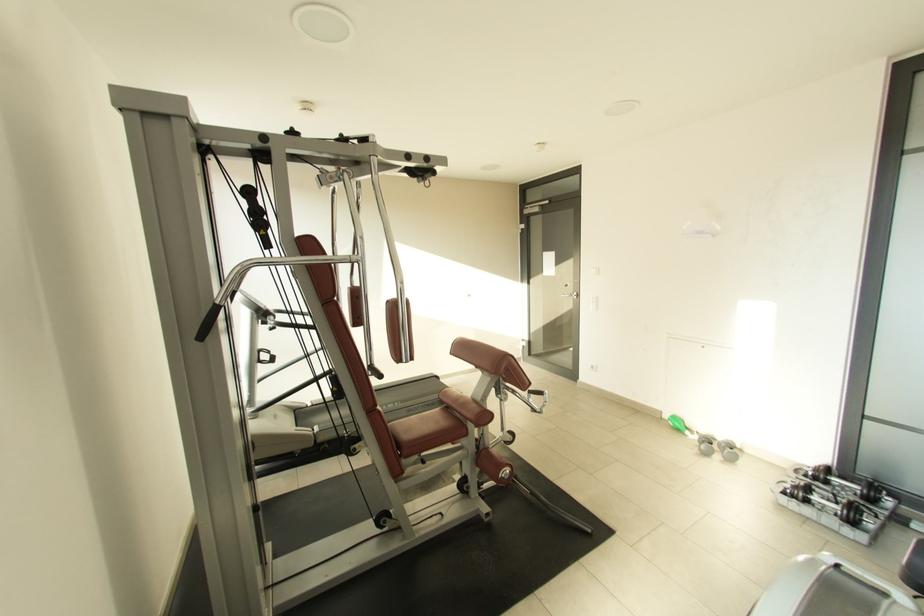
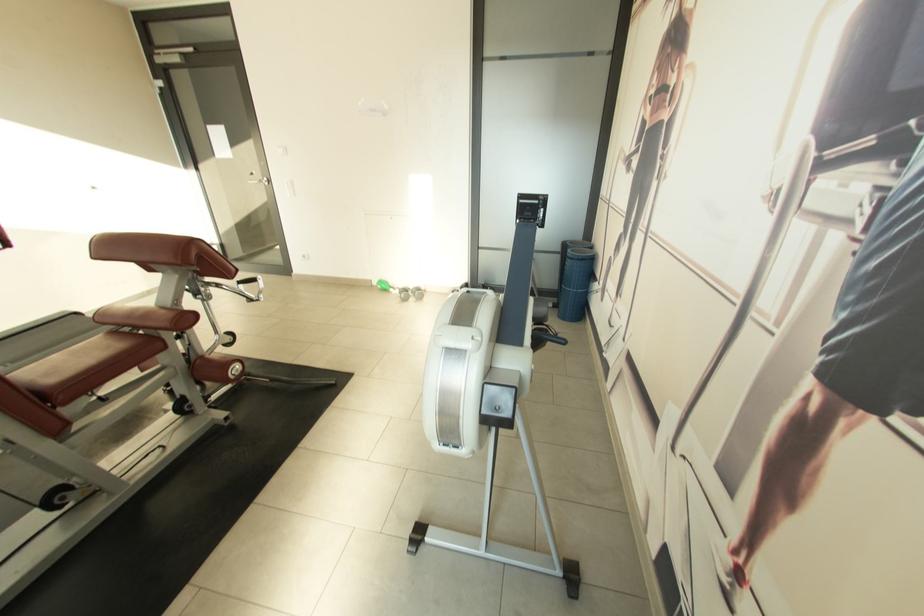
Where in the second image is the point corresponding to the point at 512,371 from the first image?

(204, 257)